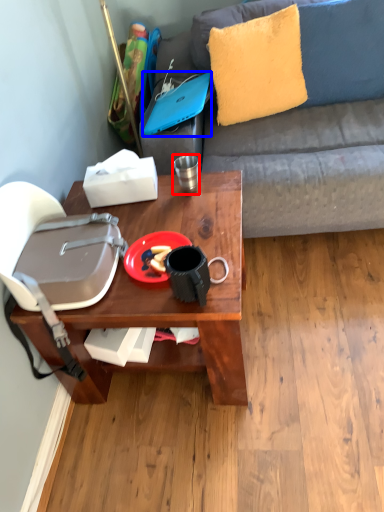
Question: Which object appears closest to the camera in this image, coffee cup (highlighted by a red box) or laptop (highlighted by a blue box)?

Choices:
 (A) coffee cup
 (B) laptop

Answer: (A)